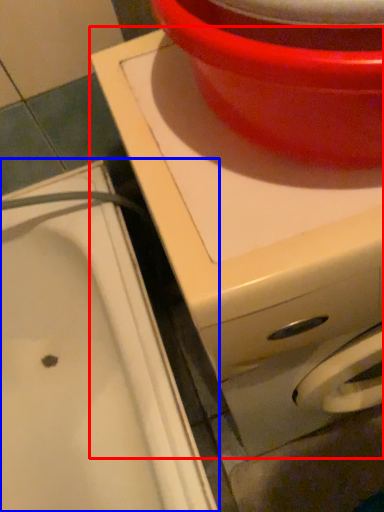
Question: Among these objects, which one is nearest to the camera, appliance (highlighted by a red box) or sink (highlighted by a blue box)?

Choices:
 (A) appliance
 (B) sink

Answer: (A)